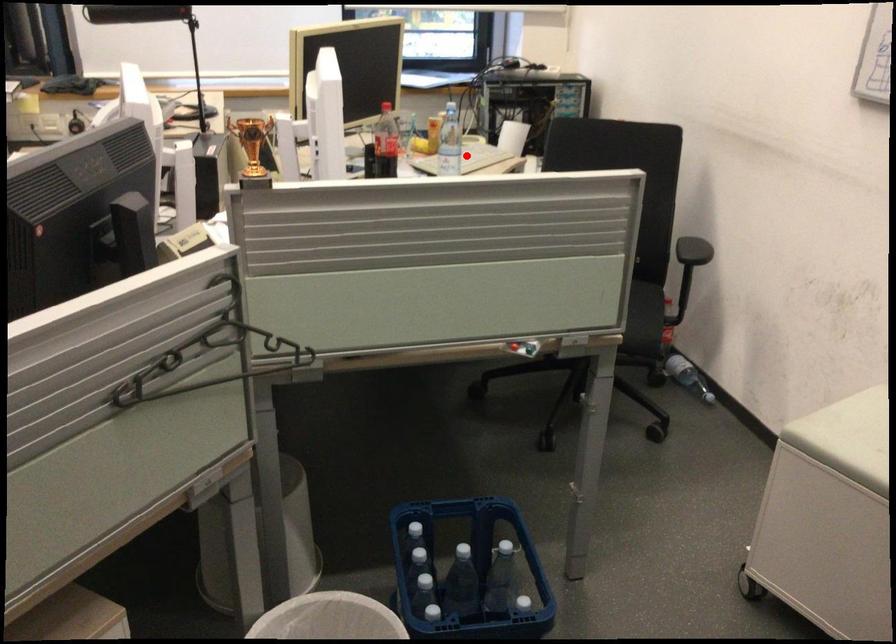
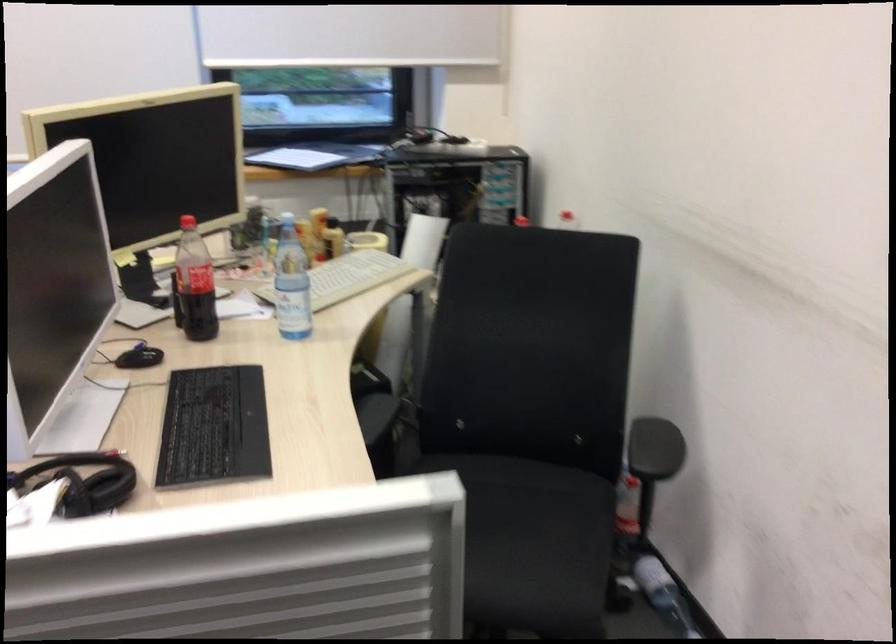
Question: I am providing you with two images of the same scene from different viewpoints. Image1 has a red point marked. In image2, the corresponding 3D location appears at what relative position? Reply with the corresponding letter.

Choices:
 (A) Closer
 (B) Farther

Answer: (A)